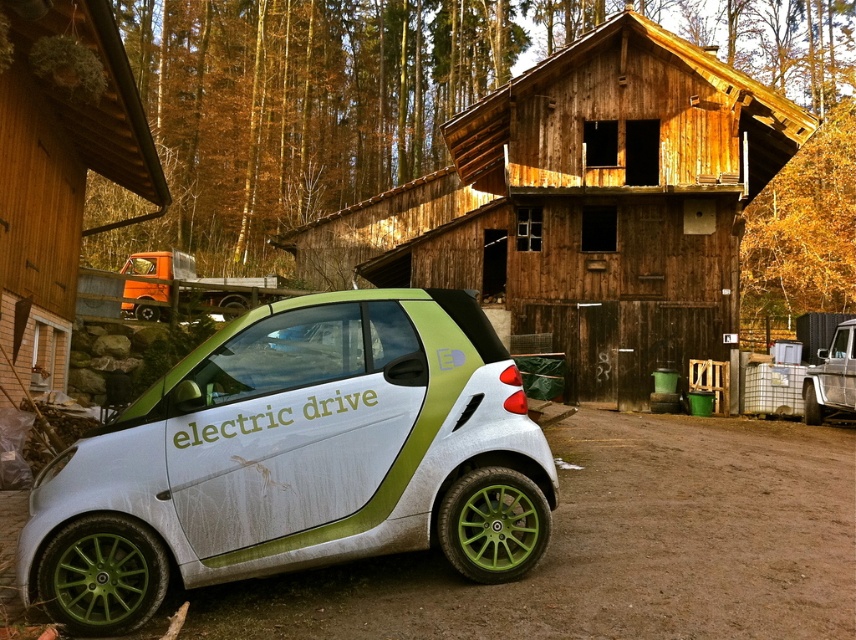
Question: Is silver metallic car at center smaller than orange matte truck at left?

Choices:
 (A) yes
 (B) no

Answer: (A)

Question: Can you confirm if silver metallic car at center is positioned to the left of wooden cabin at center?

Choices:
 (A) yes
 (B) no

Answer: (A)

Question: Is silver metallic car at center wider than white matte dirt track at center?

Choices:
 (A) no
 (B) yes

Answer: (A)

Question: Which of the following is the closest to the observer?

Choices:
 (A) wooden cabin at center
 (B) orange matte truck at left
 (C) silver metallic car at center
 (D) white matte dirt track at center

Answer: (D)

Question: Estimate the real-world distances between objects in this image. Which object is closer to the white matte dirt track at center?

Choices:
 (A) wooden cabin at center
 (B) orange matte truck at left

Answer: (B)

Question: Estimate the real-world distances between objects in this image. Which object is farther from the silver metallic car at center?

Choices:
 (A) wooden cabin at center
 (B) orange matte truck at left

Answer: (A)